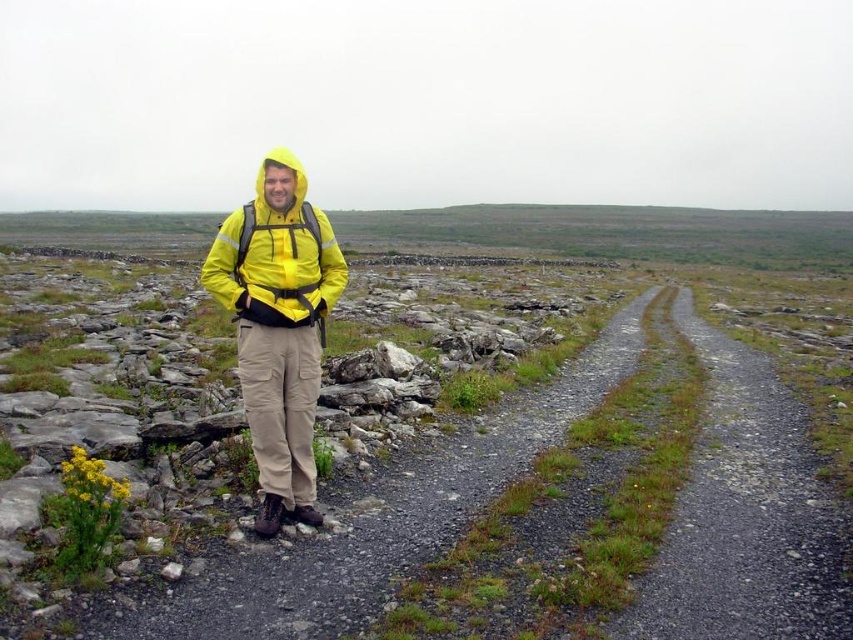
The width and height of the screenshot is (853, 640). What do you see at coordinates (277, 326) in the screenshot?
I see `yellow matte jacket at center` at bounding box center [277, 326].

Does yellow matte jacket at center appear over matte yellow jacket at center?

Incorrect, yellow matte jacket at center is not positioned above matte yellow jacket at center.

Which is in front, point (247, 353) or point (260, 278)?

Point (247, 353) is more forward.

Identify the location of yellow matte jacket at center. The height and width of the screenshot is (640, 853). (277, 326).